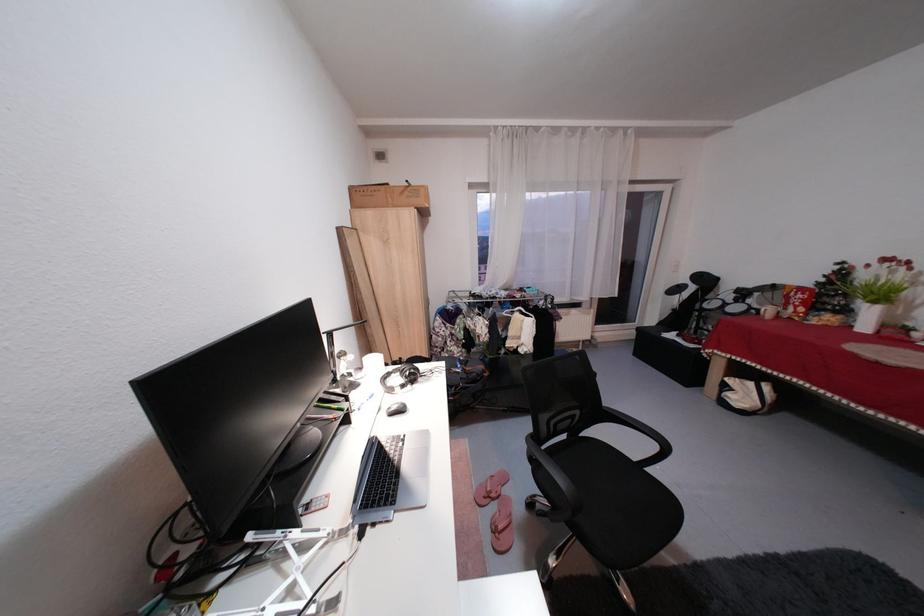
Find where to sit the chair sitting surface. Please return your answer as a coordinate pair (x, y).

(616, 504)